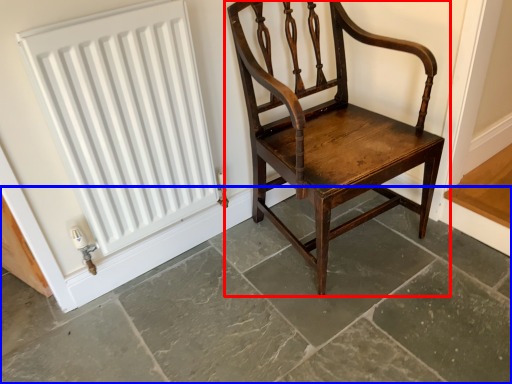
Question: Among these objects, which one is farthest to the camera, chair (highlighted by a red box) or concrete (highlighted by a blue box)?

Choices:
 (A) chair
 (B) concrete

Answer: (A)